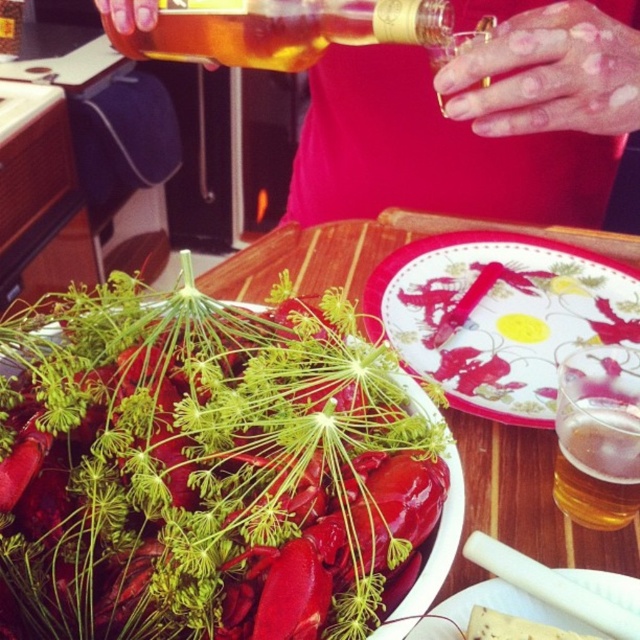
Is smooth plastic bottle at upper center taller than white glossy plate at center?

Yes.

Is smooth plastic bottle at upper center thinner than white glossy plate at center?

Incorrect, smooth plastic bottle at upper center's width is not less than white glossy plate at center's.

Does point (385, 70) come in front of point (445, 234)?

No, it is not.

The height and width of the screenshot is (640, 640). Find the location of `smooth plastic bottle at upper center`. smooth plastic bottle at upper center is located at coordinates (476, 120).

Does shiny red lobster at center have a lesser width compared to translucent glass beer at upper right?

No.

Does shiny red lobster at center have a greater height compared to translucent glass beer at upper right?

Correct, shiny red lobster at center is much taller as translucent glass beer at upper right.

Between point (116, 474) and point (621, 435), which one is positioned in front?

Positioned in front is point (116, 474).

The width and height of the screenshot is (640, 640). What are the coordinates of `shiny red lobster at center` in the screenshot? It's located at (205, 472).

Who is more forward, (x=74, y=461) or (x=556, y=12)?

Point (x=74, y=461) is more forward.

Identify the location of shiny red lobster at center. (205, 472).